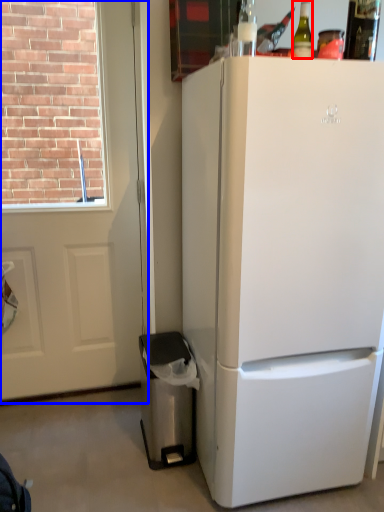
Question: Which of the following is the closest to the observer, bottle (highlighted by a red box) or screen door (highlighted by a blue box)?

Choices:
 (A) bottle
 (B) screen door

Answer: (A)